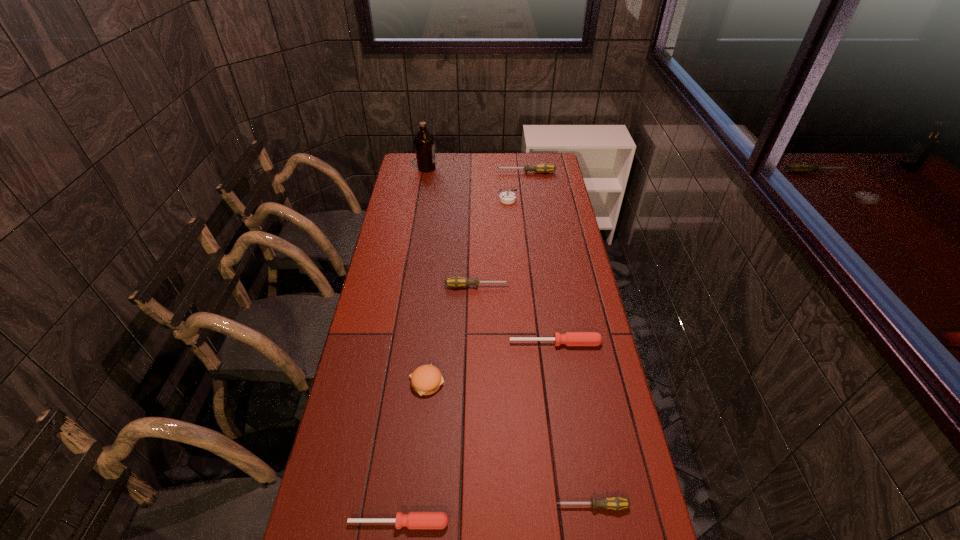
Locate an element on the screen. olive oil is located at coordinates (424, 142).

Identify the location of the tallest object. pos(424,142).

Where is `compass`? This screenshot has width=960, height=540. compass is located at coordinates (506, 197).

Find the location of a particular element. This screenshot has width=960, height=540. the tallest screwdriver is located at coordinates (543, 167).

In order to click on the farthest gray screwdriver in this screenshot , I will do `click(543, 167)`.

This screenshot has width=960, height=540. I want to click on patty, so [x=426, y=379].

What are the coordinates of `the second smallest gray screwdriver` in the screenshot? It's located at (456, 281).

Identify the location of the second nearest gray screwdriver. [x=456, y=281].

The image size is (960, 540). What are the coordinates of `the fifth farthest object` in the screenshot? It's located at point(569,338).

Locate an element on the screen. the right red screwdriver is located at coordinates (569, 338).